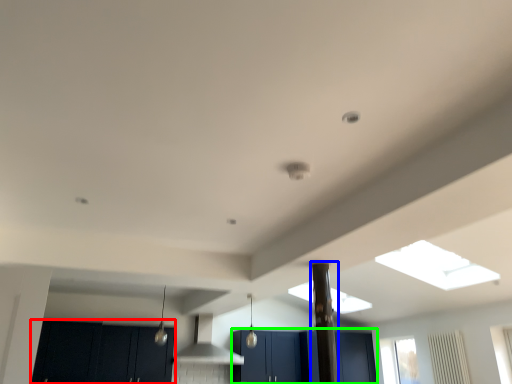
Question: Which is nearer to the cabinetry (highlighted by a red box)? pillar (highlighted by a blue box) or cabinetry (highlighted by a green box).

Choices:
 (A) pillar
 (B) cabinetry

Answer: (B)